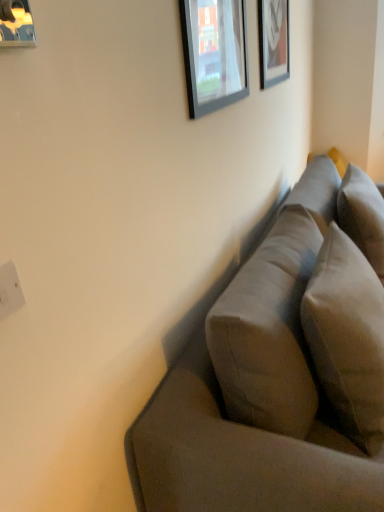
Describe the element at coordinates (282, 369) in the screenshot. The height and width of the screenshot is (512, 384). I see `suede-like gray couch at right` at that location.

In order to click on wooden frame at upper right, positioned as the 1th picture frame in right-to-left order in this screenshot , I will do `click(273, 41)`.

Describe the element at coordinates (347, 337) in the screenshot. This screenshot has height=512, width=384. I see `suede-like beige pillow at right` at that location.

This screenshot has height=512, width=384. I want to click on suede-like gray couch at right, so click(282, 369).

Considering the relative sizes of suede-like gray couch at right and wooden frame at upper right, positioned as the 1th picture frame in right-to-left order, in the image provided, is suede-like gray couch at right taller than wooden frame at upper right, positioned as the 1th picture frame in right-to-left order,?

Indeed, suede-like gray couch at right has a greater height compared to wooden frame at upper right, positioned as the 1th picture frame in right-to-left order.

Which is more to the left, suede-like gray couch at right or wooden frame at upper right, positioned as the 1th picture frame in right-to-left order?

Positioned to the left is wooden frame at upper right, positioned as the 1th picture frame in right-to-left order.

Is suede-like gray couch at right touching wooden frame at upper right, acting as the first picture frame starting from the back?

No, suede-like gray couch at right is not in contact with wooden frame at upper right, acting as the first picture frame starting from the back.

Where is `studio couch below the wooden frame at upper right, positioned as the third picture frame in front-to-back order (from the image's perspective)`? studio couch below the wooden frame at upper right, positioned as the third picture frame in front-to-back order (from the image's perspective) is located at coordinates (282, 369).

Considering the relative sizes of white plastic electric outlet at lower left and metallic silver picture frame at upper left, the third picture frame viewed from the back, in the image provided, is white plastic electric outlet at lower left bigger than metallic silver picture frame at upper left, the third picture frame viewed from the back,?

No.

Is point (14, 302) closer to camera compared to point (22, 1)?

Yes, it is.

In terms of height, does white plastic electric outlet at lower left look taller or shorter compared to metallic silver picture frame at upper left, which is counted as the third picture frame, starting from the right?

Clearly, white plastic electric outlet at lower left is shorter compared to metallic silver picture frame at upper left, which is counted as the third picture frame, starting from the right.

From a real-world perspective, is white plastic electric outlet at lower left above or below metallic silver picture frame at upper left, the third picture frame viewed from the back?

From a real-world perspective, white plastic electric outlet at lower left is physically below metallic silver picture frame at upper left, the third picture frame viewed from the back.

Considering the sizes of suede-like gray couch at right and white plastic electric outlet at lower left in the image, is suede-like gray couch at right bigger or smaller than white plastic electric outlet at lower left?

In the image, suede-like gray couch at right appears to be larger than white plastic electric outlet at lower left.

Which object is thinner, suede-like gray couch at right or white plastic electric outlet at lower left?

white plastic electric outlet at lower left.

How far apart are suede-like gray couch at right and white plastic electric outlet at lower left?

suede-like gray couch at right is 37.57 inches from white plastic electric outlet at lower left.

Does suede-like gray couch at right appear on the left side of white plastic electric outlet at lower left?

In fact, suede-like gray couch at right is to the right of white plastic electric outlet at lower left.

From the picture: Is white plastic electric outlet at lower left next to wooden frame at upper right, acting as the first picture frame starting from the back, and touching it?

white plastic electric outlet at lower left and wooden frame at upper right, acting as the first picture frame starting from the back, are clearly separated.

Which is closer, (19, 303) or (270, 51)?

The point (19, 303) is closer.

Is white plastic electric outlet at lower left wider than wooden frame at upper right, positioned as the 1th picture frame in right-to-left order?

No, white plastic electric outlet at lower left is not wider than wooden frame at upper right, positioned as the 1th picture frame in right-to-left order.

Relative to wooden frame at upper right, marked as the 3th picture frame in a left-to-right arrangement, is white plastic electric outlet at lower left in front or behind?

Clearly, white plastic electric outlet at lower left is in front of wooden frame at upper right, marked as the 3th picture frame in a left-to-right arrangement.

Considering the sizes of metallic silver picture frame at upper left, which is counted as the third picture frame, starting from the right, and suede-like beige pillow at right in the image, is metallic silver picture frame at upper left, which is counted as the third picture frame, starting from the right, taller or shorter than suede-like beige pillow at right?

In the image, metallic silver picture frame at upper left, which is counted as the third picture frame, starting from the right, appears to be shorter than suede-like beige pillow at right.

Is metallic silver picture frame at upper left, acting as the 1th picture frame starting from the left, with suede-like beige pillow at right?

No, metallic silver picture frame at upper left, acting as the 1th picture frame starting from the left, is not touching suede-like beige pillow at right.

Considering the relative positions of metallic silver picture frame at upper left, positioned as the first picture frame in front-to-back order, and suede-like beige pillow at right in the image provided, is metallic silver picture frame at upper left, positioned as the first picture frame in front-to-back order, in front of suede-like beige pillow at right?

Yes.

At what (x,y) coordinates should I click in order to perform the action: click on picture frame that is the 2nd one when counting upward from the suede-like beige pillow at right (from the image's perspective). Please return your answer as a coordinate pair (x, y). Looking at the image, I should click on (214, 53).

Looking at this image, considering the relative sizes of suede-like beige pillow at right and matte glass picture frame at upper center, positioned as the 2th picture frame in right-to-left order, in the image provided, is suede-like beige pillow at right smaller than matte glass picture frame at upper center, positioned as the 2th picture frame in right-to-left order,?

No, suede-like beige pillow at right is not smaller than matte glass picture frame at upper center, positioned as the 2th picture frame in right-to-left order.

In terms of width, does suede-like beige pillow at right look wider or thinner when compared to matte glass picture frame at upper center, which ranks as the second picture frame in left-to-right order?

In the image, suede-like beige pillow at right appears to be wider than matte glass picture frame at upper center, which ranks as the second picture frame in left-to-right order.

Based on the photo, measure the distance between suede-like beige pillow at right and matte glass picture frame at upper center, which ranks as the second picture frame in left-to-right order.

suede-like beige pillow at right is 30.93 inches away from matte glass picture frame at upper center, which ranks as the second picture frame in left-to-right order.

Which object is further away from the camera, wooden frame at upper right, acting as the first picture frame starting from the back, or white plastic electric outlet at lower left?

Positioned behind is wooden frame at upper right, acting as the first picture frame starting from the back.

Is wooden frame at upper right, positioned as the third picture frame in front-to-back order, thinner than white plastic electric outlet at lower left?

In fact, wooden frame at upper right, positioned as the third picture frame in front-to-back order, might be wider than white plastic electric outlet at lower left.

Which of these two, wooden frame at upper right, positioned as the third picture frame in front-to-back order, or white plastic electric outlet at lower left, is bigger?

With larger size is wooden frame at upper right, positioned as the third picture frame in front-to-back order.

From a real-world perspective, is wooden frame at upper right, positioned as the third picture frame in front-to-back order, positioned over white plastic electric outlet at lower left based on gravity?

Yes, from a real-world perspective, wooden frame at upper right, positioned as the third picture frame in front-to-back order, is above white plastic electric outlet at lower left.

At what (x,y) coordinates should I click in order to perform the action: click on studio couch that is below the wooden frame at upper right, marked as the 3th picture frame in a left-to-right arrangement (from the image's perspective). Please return your answer as a coordinate pair (x, y). This screenshot has height=512, width=384. Looking at the image, I should click on (282, 369).

From a real-world perspective, starting from the white plastic electric outlet at lower left, which picture frame is the 3rd one vertically above it? Please provide its 2D coordinates.

[(16, 24)]

Looking at the image, which one is located closer to matte glass picture frame at upper center, the 2th picture frame from the front, suede-like beige pillow at right or metallic silver picture frame at upper left, which is counted as the third picture frame, starting from the right?

suede-like beige pillow at right is positioned closer to the anchor matte glass picture frame at upper center, the 2th picture frame from the front.

Looking at the image, which one is located further to wooden frame at upper right, marked as the 3th picture frame in a left-to-right arrangement, suede-like beige pillow at right or suede-like gray couch at right?

suede-like beige pillow at right is positioned further to the anchor wooden frame at upper right, marked as the 3th picture frame in a left-to-right arrangement.

Looking at the image, which one is located further to wooden frame at upper right, acting as the first picture frame starting from the back, suede-like gray couch at right or metallic silver picture frame at upper left, the third picture frame viewed from the back?

metallic silver picture frame at upper left, the third picture frame viewed from the back, lies further to wooden frame at upper right, acting as the first picture frame starting from the back, than the other object.

From the image, which object appears to be farther from metallic silver picture frame at upper left, positioned as the first picture frame in front-to-back order, wooden frame at upper right, marked as the 3th picture frame in a left-to-right arrangement, or white plastic electric outlet at lower left?

white plastic electric outlet at lower left lies further to metallic silver picture frame at upper left, positioned as the first picture frame in front-to-back order, than the other object.

Which object lies nearer to the anchor point metallic silver picture frame at upper left, positioned as the first picture frame in front-to-back order, suede-like beige pillow at right or wooden frame at upper right, marked as the 3th picture frame in a left-to-right arrangement?

Based on the image, wooden frame at upper right, marked as the 3th picture frame in a left-to-right arrangement, appears to be nearer to metallic silver picture frame at upper left, positioned as the first picture frame in front-to-back order.

When comparing their distances from suede-like beige pillow at right, does suede-like gray couch at right or white plastic electric outlet at lower left seem further?

white plastic electric outlet at lower left is positioned further to the anchor suede-like beige pillow at right.

Which object lies nearer to the anchor point white plastic electric outlet at lower left, metallic silver picture frame at upper left, acting as the 1th picture frame starting from the left, or suede-like gray couch at right?

suede-like gray couch at right lies closer to white plastic electric outlet at lower left than the other object.

Looking at the image, which one is located further to white plastic electric outlet at lower left, matte glass picture frame at upper center, positioned as the 2th picture frame in right-to-left order, or suede-like beige pillow at right?

matte glass picture frame at upper center, positioned as the 2th picture frame in right-to-left order.

The width and height of the screenshot is (384, 512). What are the coordinates of `electric outlet located between metallic silver picture frame at upper left, positioned as the first picture frame in front-to-back order, and wooden frame at upper right, acting as the first picture frame starting from the back, in the depth direction` in the screenshot? It's located at (10, 290).

The height and width of the screenshot is (512, 384). I want to click on pillow situated between white plastic electric outlet at lower left and suede-like gray couch at right from left to right, so click(347, 337).

What are the coordinates of `studio couch between wooden frame at upper right, positioned as the 1th picture frame in right-to-left order, and suede-like beige pillow at right from top to bottom` in the screenshot? It's located at pos(282,369).

Where is `electric outlet between wooden frame at upper right, positioned as the 1th picture frame in right-to-left order, and suede-like beige pillow at right in the up-down direction`? electric outlet between wooden frame at upper right, positioned as the 1th picture frame in right-to-left order, and suede-like beige pillow at right in the up-down direction is located at coordinates (10, 290).